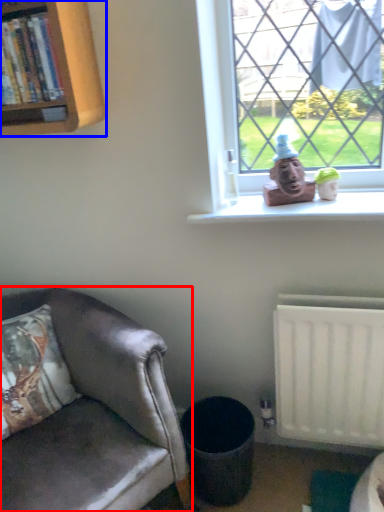
Question: Which point is further to the camera, chair (highlighted by a red box) or bookcase (highlighted by a blue box)?

Choices:
 (A) chair
 (B) bookcase

Answer: (B)